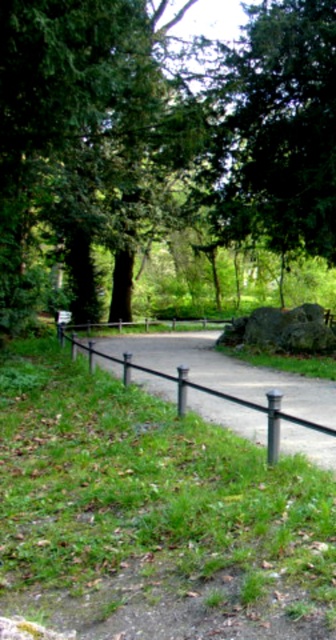
Question: Which point is farther to the camera?

Choices:
 (A) (180, 387)
 (B) (255, 209)
 (C) (277, 419)

Answer: (B)

Question: Is green leafy tree at center above green metallic pole at center?

Choices:
 (A) no
 (B) yes

Answer: (B)

Question: Is green leafy tree at center bigger than green metallic pole at center?

Choices:
 (A) no
 (B) yes

Answer: (B)

Question: Which of the following is the closest to the observer?

Choices:
 (A) black metal pole at center
 (B) green leafy tree at center

Answer: (A)

Question: Which of these objects is positioned farthest from the black metal pole at center?

Choices:
 (A) green leafy tree at center
 (B) green metallic pole at center

Answer: (A)

Question: Does green leafy tree at center have a smaller size compared to green metallic pole at center?

Choices:
 (A) yes
 (B) no

Answer: (B)